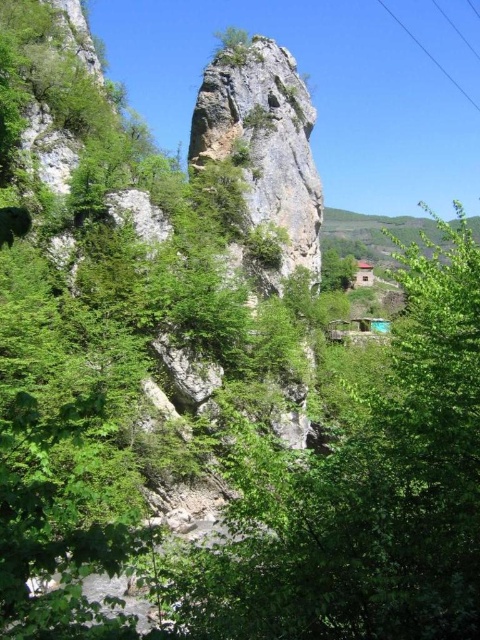
You are a hiker standing at the base of the cliff and notice the rough stone rock at center and the clear plastic power lines at upper right. Which object is nearer to you?

The rough stone rock at center is closer to the viewer than the clear plastic power lines at upper right, so the rough stone rock at center is nearer to you.

You are planning to plant a new tree that requires a space wider than the rough stone rock at center. Based on the scene, can the green leafy tree at center provide enough space for the new tree?

The green leafy tree at center is wider than the rough stone rock at center. Since the new tree requires space wider than the rough stone rock at center, the green leafy tree at center provides sufficient space for the new tree.

You are a hiker standing at the base of the cliff and see the green leafy tree at center and the rough stone rock at center. You want to place a 35 meter long rope between them to create a zip line. Will the rope be long enough?

The distance between the green leafy tree at center and the rough stone rock at center is 35.15 meters, so the 35 meter long rope will be slightly too short to span the entire distance between them.